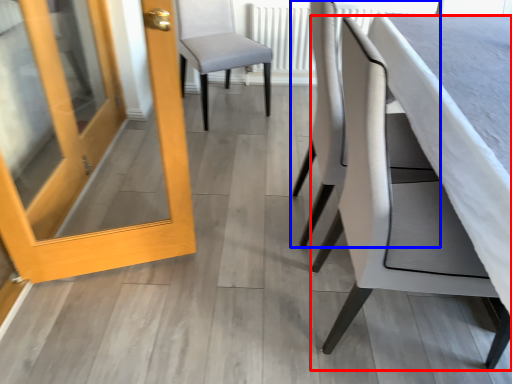
Question: Which of the following is the closest to the observer, chair (highlighted by a red box) or chair (highlighted by a blue box)?

Choices:
 (A) chair
 (B) chair

Answer: (A)